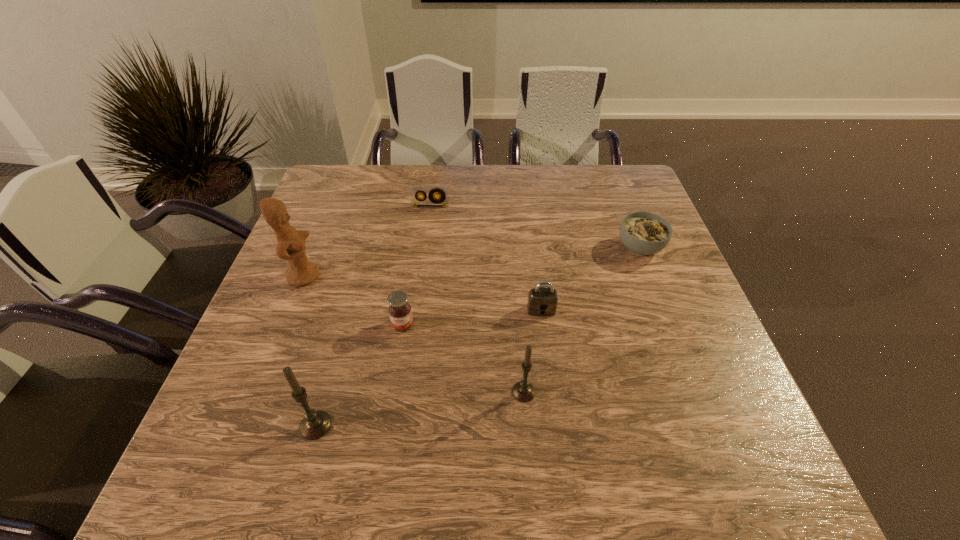
The image size is (960, 540). Find the location of `free space between the rightmost object and the leftmost object`. free space between the rightmost object and the leftmost object is located at coordinates (472, 261).

Where is `free spot between the leftmost object and the soup bowl`? The height and width of the screenshot is (540, 960). free spot between the leftmost object and the soup bowl is located at coordinates (472, 261).

Find the location of `unoccupied area between the nearer candle and the padlock`. unoccupied area between the nearer candle and the padlock is located at coordinates (428, 368).

Image resolution: width=960 pixels, height=540 pixels. I want to click on empty location between the figurine and the padlock, so click(422, 293).

Identify the location of vacant region between the tallest object and the shorter candle. The height and width of the screenshot is (540, 960). (414, 334).

Where is `free spot between the nearest object and the leftmost object`? free spot between the nearest object and the leftmost object is located at coordinates (310, 350).

The image size is (960, 540). In order to click on object that stands as the fifth closest to the tallest object in this screenshot , I will do `click(523, 391)`.

Identify which object is located as the third nearest to the jam. Please provide its 2D coordinates. Your answer should be formatted as a tuple, i.e. [(x, y)], where the tuple contains the x and y coordinates of a point satisfying the conditions above.

[(523, 391)]

The width and height of the screenshot is (960, 540). I want to click on free space that satisfies the following two spatial constraints: 1. at the front of the videotape with visible reels; 2. on the front-facing side of the tallest object, so click(x=420, y=275).

Locate an element on the screen. The width and height of the screenshot is (960, 540). free space in the image that satisfies the following two spatial constraints: 1. on the back side of the taller candle; 2. on the left side of the fifth object from left to right is located at coordinates (325, 392).